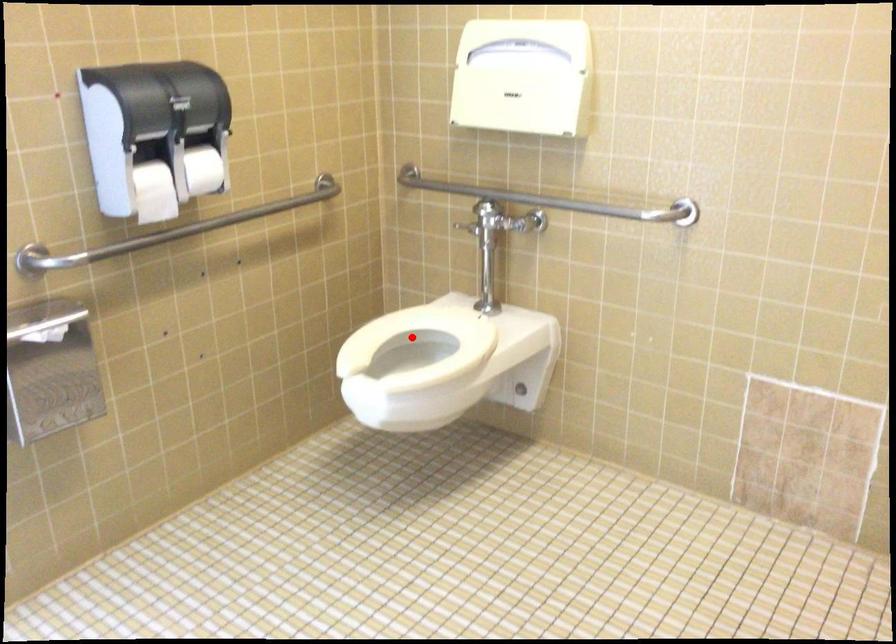
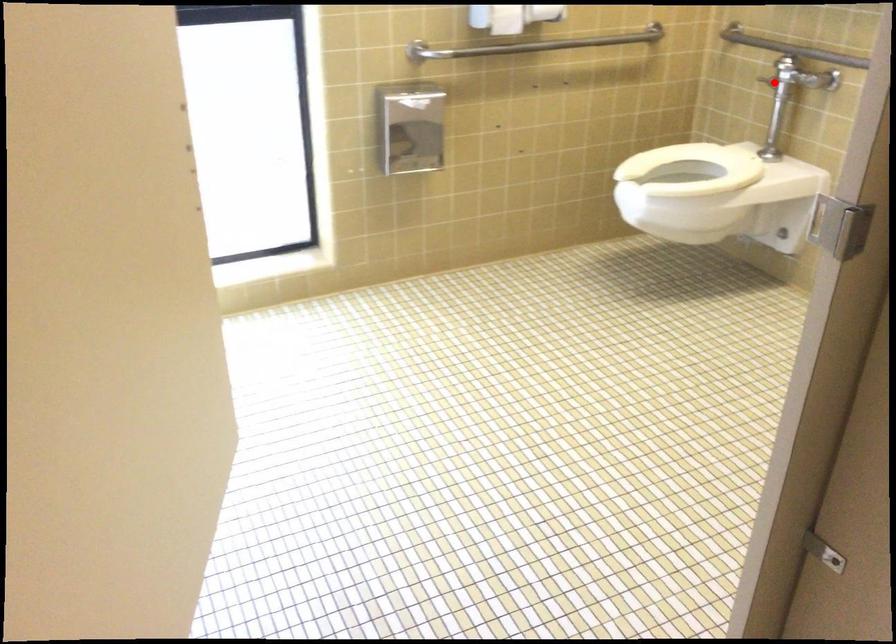
I am providing you with two images of the same scene from different viewpoints. A red point is marked on the first image and another point is marked on the second image. Do the highlighted points in image1 and image2 indicate the same real-world spot?

No